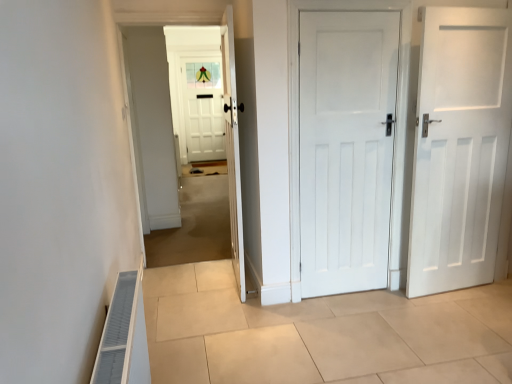
Identify the location of vacant location below white matte door at right, arranged as the first door when viewed from the right (from a real-world perspective). (462, 293).